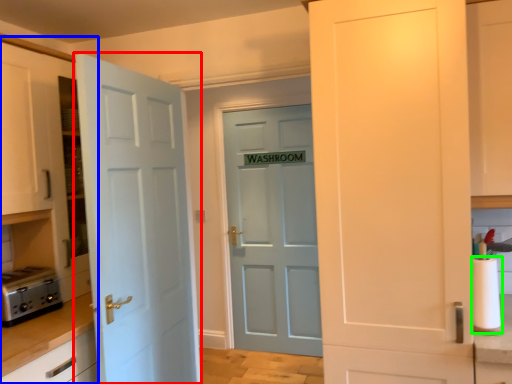
Question: Considering the real-world distances, which object is closest to door (highlighted by a red box)? dresser (highlighted by a blue box) or paper towel (highlighted by a green box).

Choices:
 (A) dresser
 (B) paper towel

Answer: (A)